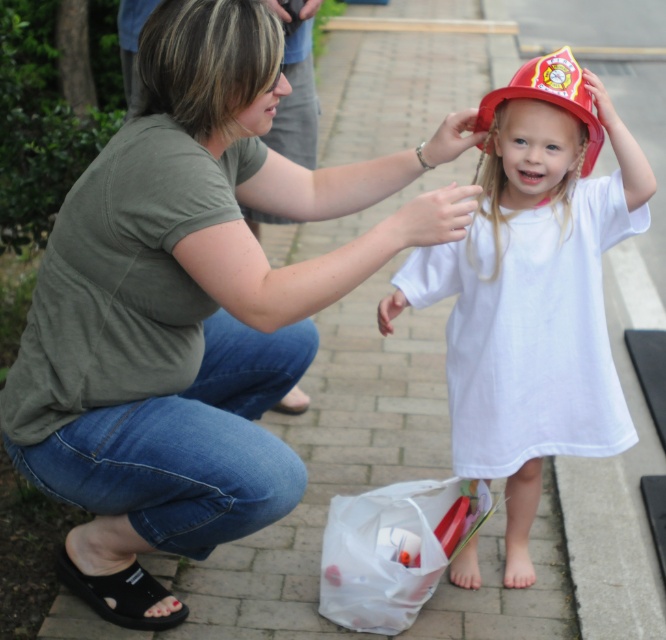
Does black rubber sandal at lower left appear on the right side of matte red hat at upper center?

No, black rubber sandal at lower left is not to the right of matte red hat at upper center.

Is black rubber sandal at lower left closer to camera compared to matte red hat at upper center?

No, black rubber sandal at lower left is further to the viewer.

Where is `black rubber sandal at lower left`? Image resolution: width=666 pixels, height=640 pixels. black rubber sandal at lower left is located at coordinates (119, 595).

You are a GUI agent. You are given a task and a screenshot of the screen. Output one action in this format:
    pyautogui.click(x=<x>, y=<y>)
    Task: Click on the black rubber sandal at lower left
    The height and width of the screenshot is (640, 666).
    Given the screenshot: What is the action you would take?
    pyautogui.click(x=119, y=595)

Which is more to the left, matte red fire helmet at center or red matte fire helmet at upper center?

matte red fire helmet at center

What are the coordinates of `matte red fire helmet at center` in the screenshot? It's located at (533, 289).

In order to click on matte red fire helmet at center in this screenshot , I will do (x=533, y=289).

Is point (230, 58) more distant than point (501, 113)?

No, (230, 58) is closer to viewer.

Consider the image. How distant is matte green shirt at center from matte red fire helmet at center?

A distance of 23.01 inches exists between matte green shirt at center and matte red fire helmet at center.

Between point (220, 204) and point (480, 444), which one is positioned behind?

The point (480, 444) is behind.

At what (x,y) coordinates should I click in order to perform the action: click on matte green shirt at center. Please return your answer as a coordinate pair (x, y). Looking at the image, I should click on (184, 305).